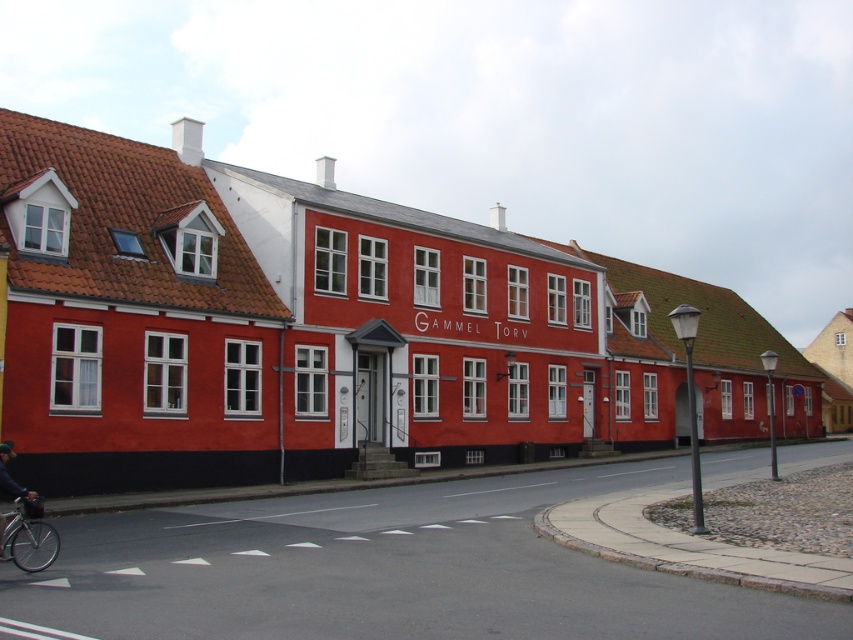
Which of these two, silver metallic bicycle at lower left or dark blue fabric jacket at lower left, stands shorter?

Standing shorter between the two is silver metallic bicycle at lower left.

Is point (4, 534) behind point (0, 444)?

No.

Is point (20, 508) behind point (10, 440)?

No, it is not.

I want to click on silver metallic bicycle at lower left, so click(28, 538).